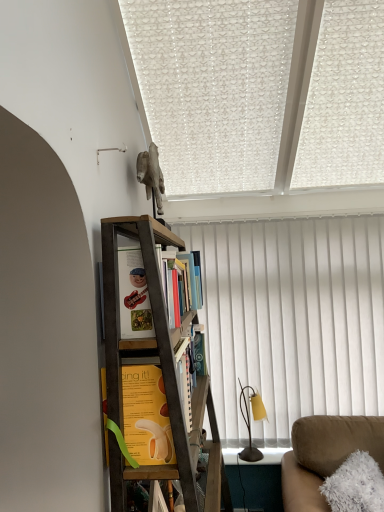
Question: Would you say metallic yellow table lamp at right is part of hardcover books at center, acting as the 2th book starting from the front,'s contents?

Choices:
 (A) yes
 (B) no

Answer: (B)

Question: Is hardcover books at center, placed as the second book when sorted from bottom to top, outside of metallic yellow table lamp at right?

Choices:
 (A) no
 (B) yes

Answer: (B)

Question: Does hardcover books at center, placed as the second book when sorted from bottom to top, turn towards metallic yellow table lamp at right?

Choices:
 (A) no
 (B) yes

Answer: (A)

Question: From the image's perspective, would you say hardcover books at center, placed as the second book when sorted from bottom to top, is shown under metallic yellow table lamp at right?

Choices:
 (A) yes
 (B) no

Answer: (B)

Question: Considering the relative sizes of hardcover books at center, the 1th book positioned from the top, and metallic yellow table lamp at right in the image provided, is hardcover books at center, the 1th book positioned from the top, wider than metallic yellow table lamp at right?

Choices:
 (A) no
 (B) yes

Answer: (B)

Question: Considering their positions, is hardcover books at center, marked as the first book in a back-to-front arrangement, located in front of or behind metallic yellow table lamp at right?

Choices:
 (A) front
 (B) behind

Answer: (A)

Question: From the image's perspective, is hardcover books at center, marked as the first book in a back-to-front arrangement, located above or below metallic yellow table lamp at right?

Choices:
 (A) below
 (B) above

Answer: (B)

Question: From a real-world perspective, is hardcover books at center, acting as the 2th book starting from the front, positioned above or below metallic yellow table lamp at right?

Choices:
 (A) above
 (B) below

Answer: (A)

Question: Is hardcover books at center, acting as the 2th book starting from the front, taller or shorter than metallic yellow table lamp at right?

Choices:
 (A) tall
 (B) short

Answer: (B)

Question: Looking at the image, does gray stone horse at upper center seem bigger or smaller compared to hardcover books at center, acting as the 2th book starting from the front?

Choices:
 (A) small
 (B) big

Answer: (B)

Question: Is gray stone horse at upper center to the left or to the right of hardcover books at center, acting as the 2th book starting from the front, in the image?

Choices:
 (A) left
 (B) right

Answer: (A)

Question: From the image's perspective, relative to hardcover books at center, acting as the 2th book starting from the front, is gray stone horse at upper center above or below?

Choices:
 (A) below
 (B) above

Answer: (B)

Question: In terms of height, does gray stone horse at upper center look taller or shorter compared to hardcover books at center, placed as the second book when sorted from bottom to top?

Choices:
 (A) short
 (B) tall

Answer: (B)

Question: Does point (145, 425) appear closer or farther from the camera than point (168, 246)?

Choices:
 (A) closer
 (B) farther

Answer: (A)

Question: From the image's perspective, relative to hardcover books at center, placed as the second book when sorted from bottom to top, is yellow paper at center, which is counted as the second book, starting from the top, above or below?

Choices:
 (A) above
 (B) below

Answer: (B)